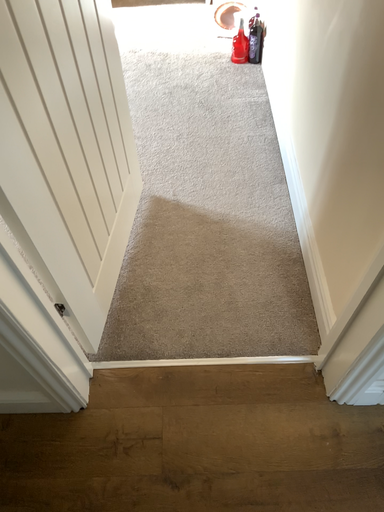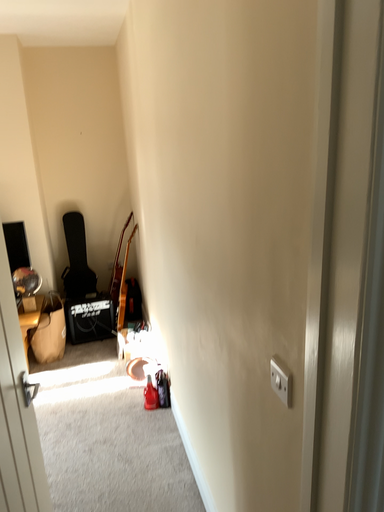
Question: Which way did the camera rotate in the video?

Choices:
 (A) rotated right
 (B) rotated left

Answer: (A)